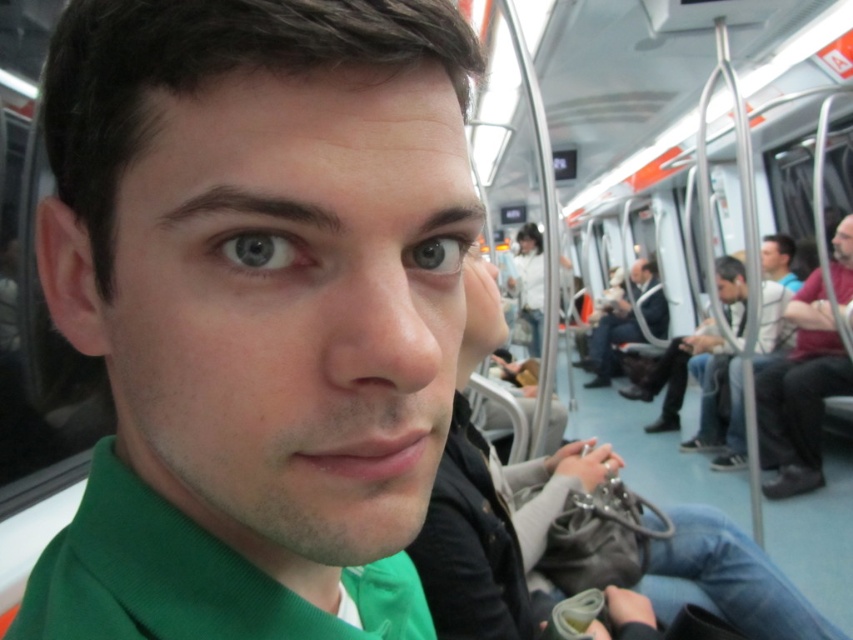
Question: Can you confirm if green matte sweater at center is positioned to the right of dark blue jacket at center?

Choices:
 (A) yes
 (B) no

Answer: (B)

Question: Which of the following is the closest to the observer?

Choices:
 (A) dark blue jacket at center
 (B) dark red sweater at right

Answer: (B)

Question: Can you confirm if dark red sweater at right is bigger than blue matte eye at center?

Choices:
 (A) yes
 (B) no

Answer: (A)

Question: Which point is closer to the camera?

Choices:
 (A) dark blue jacket at center
 (B) blue matte eye at center
 (C) blue glossy eye at center
 (D) green matte sweater at center

Answer: (D)

Question: Can you confirm if dark blue jacket at center is positioned to the right of blue glossy eye at center?

Choices:
 (A) no
 (B) yes

Answer: (B)

Question: Based on their relative distances, which object is nearer to the dark blue jeans at right?

Choices:
 (A) dark blue jacket at center
 (B) blue glossy eye at center
 (C) dark red sweater at right
 (D) green matte sweater at center

Answer: (C)